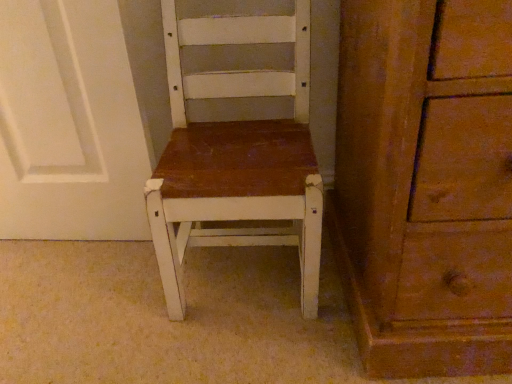
Question: Should I look upward or downward to see matte white chair at center?

Choices:
 (A) down
 (B) up

Answer: (B)